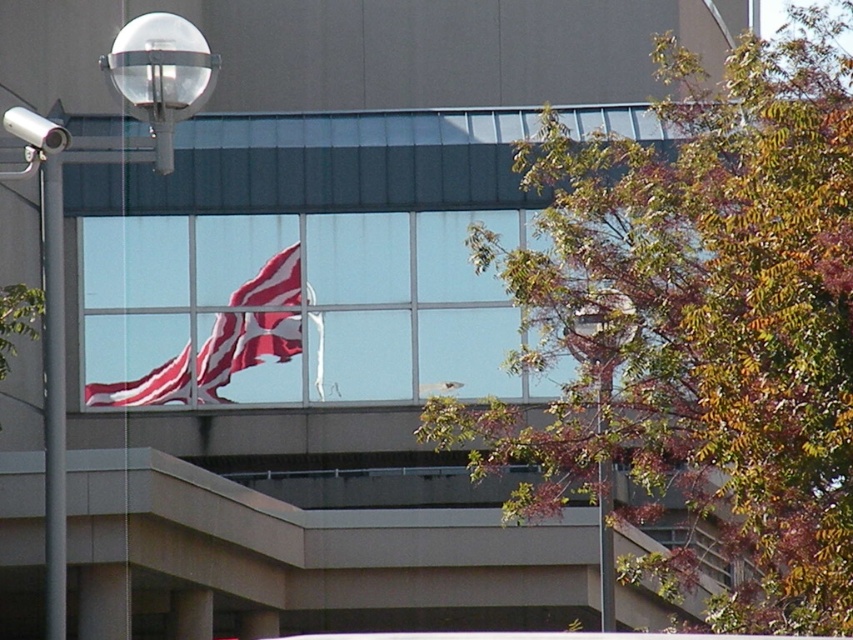
Question: Is metallic gray pole at left positioned at the back of metallic glass lamp post at upper center?

Choices:
 (A) no
 (B) yes

Answer: (A)

Question: Can you confirm if metallic glass globe at upper left is bigger than metallic gray pole at left?

Choices:
 (A) no
 (B) yes

Answer: (B)

Question: Which point is closer to the camera taking this photo?

Choices:
 (A) (62, 420)
 (B) (161, 52)

Answer: (B)

Question: Which object appears closest to the camera in this image?

Choices:
 (A) red/white striped fabric at center
 (B) metallic glass globe at upper left
 (C) metallic gray pole at left

Answer: (B)

Question: Is red/white striped fabric at center bigger than metallic glass lamp post at upper center?

Choices:
 (A) yes
 (B) no

Answer: (A)

Question: Which point is farther from the camera taking this photo?

Choices:
 (A) (276, 272)
 (B) (49, 529)
 (C) (602, 502)
 (D) (56, 410)

Answer: (A)